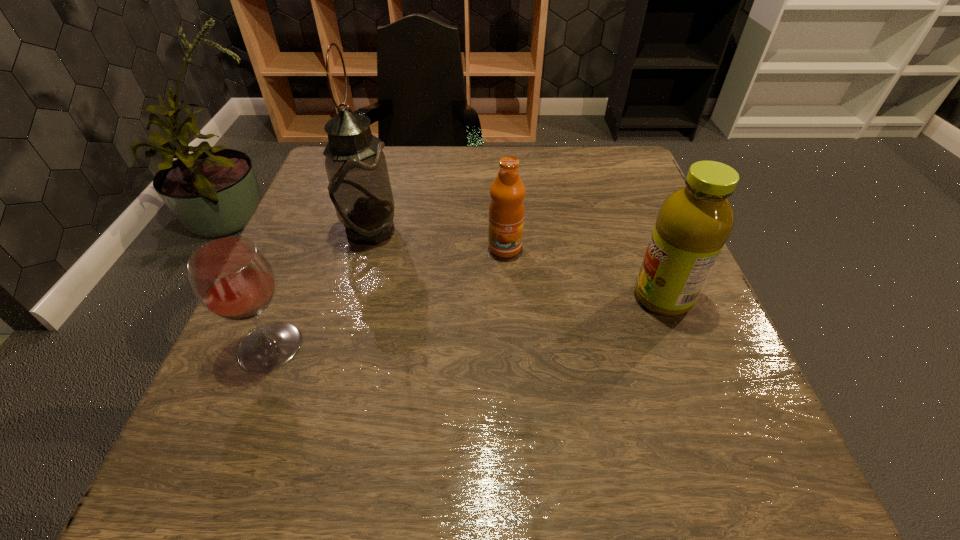
Locate an element on the screen. This screenshot has width=960, height=540. oil lamp is located at coordinates (359, 186).

The image size is (960, 540). I want to click on the rightmost object, so [x=694, y=222].

Locate an element on the screen. This screenshot has height=540, width=960. the right fruit juice is located at coordinates (694, 222).

This screenshot has width=960, height=540. What are the coordinates of `the second object from right to left` in the screenshot? It's located at (506, 210).

The height and width of the screenshot is (540, 960). Find the location of `the shorter fruit juice`. the shorter fruit juice is located at coordinates (506, 210).

This screenshot has height=540, width=960. What are the coordinates of `wineglass` in the screenshot? It's located at (231, 277).

What are the coordinates of `vacant space located 0.200m on the front of the oil lamp` in the screenshot? It's located at (343, 328).

Locate an element on the screen. This screenshot has width=960, height=540. free space located 0.220m on the front label of the right fruit juice is located at coordinates (515, 298).

You are a GUI agent. You are given a task and a screenshot of the screen. Output one action in this format:
    pyautogui.click(x=<x>, y=<y>)
    Task: Click on the free space located on the front label of the right fruit juice
    The height and width of the screenshot is (540, 960).
    Given the screenshot: What is the action you would take?
    pyautogui.click(x=418, y=298)

Where is `vacant area located on the front label of the right fruit juice`? The width and height of the screenshot is (960, 540). vacant area located on the front label of the right fruit juice is located at coordinates (476, 298).